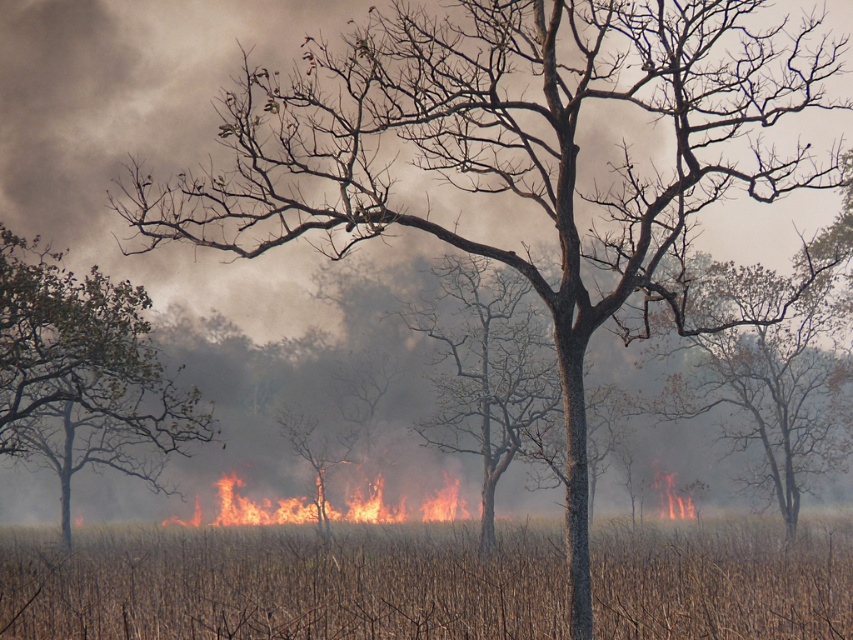
Who is positioned more to the left, brown dry grass at center or smooth bark tree at center?

From the viewer's perspective, smooth bark tree at center appears more on the left side.

Who is more forward, (299, 538) or (521, 346)?

Point (521, 346) is more forward.

Where is `brown dry grass at center`? This screenshot has width=853, height=640. brown dry grass at center is located at coordinates (283, 584).

Measure the distance between brown leafless tree at left and smooth bark tree at center.

A distance of 42.43 feet exists between brown leafless tree at left and smooth bark tree at center.

Between point (90, 435) and point (462, 403), which one is positioned in front?

Point (462, 403) is in front.

Identify the location of brown leafless tree at left. Image resolution: width=853 pixels, height=640 pixels. (84, 372).

Is brown dry grass at center to the right of brown leafless tree at left from the viewer's perspective?

Correct, you'll find brown dry grass at center to the right of brown leafless tree at left.

Looking at this image, between brown dry grass at center and brown leafless tree at left, which one is positioned lower?

Positioned lower is brown dry grass at center.

Find the location of `brown dry grass at center`. brown dry grass at center is located at coordinates (283, 584).